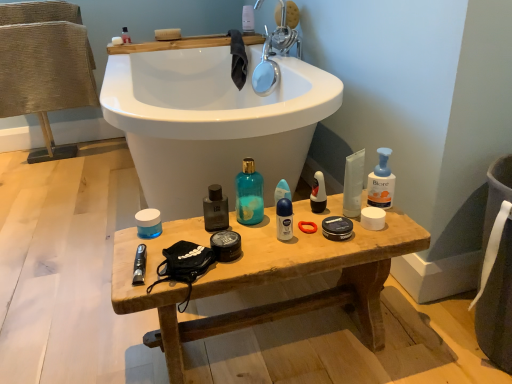
What are the coordinates of `empty space that is to the right of metallic black razor at lower left` in the screenshot? It's located at (214, 252).